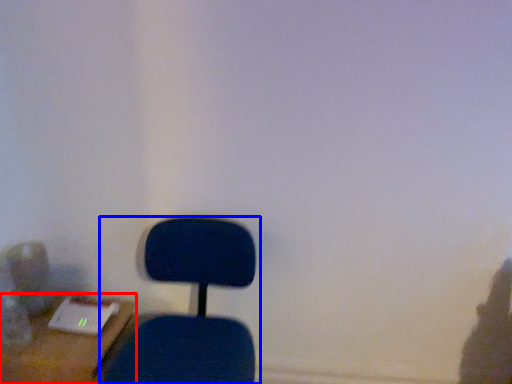
Question: Among these objects, which one is farthest to the camera, furniture (highlighted by a red box) or chair (highlighted by a blue box)?

Choices:
 (A) furniture
 (B) chair

Answer: (A)